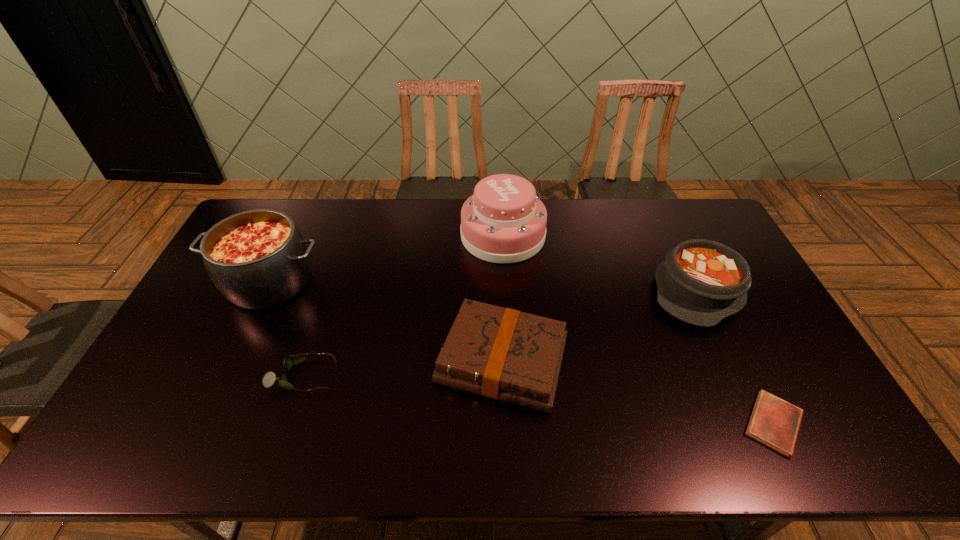
Locate an element on the screen. cake is located at coordinates (504, 221).

Identify the location of the taller casserole. (257, 259).

You are a GUI agent. You are given a task and a screenshot of the screen. Output one action in this format:
    pyautogui.click(x=<x>, y=<y>)
    Task: Click on the right casserole
    The image size is (960, 540).
    Given the screenshot: What is the action you would take?
    pyautogui.click(x=701, y=282)

Where is `the fourth shortest object`? the fourth shortest object is located at coordinates (701, 282).

In order to click on hardback book in this screenshot , I will do `click(500, 353)`.

Find the location of a particular element. This screenshot has height=540, width=960. the fifth tallest object is located at coordinates (269, 378).

You are a GUI agent. You are given a task and a screenshot of the screen. Output one action in this format:
    pyautogui.click(x=<x>, y=<y>)
    Task: Click on the shortest object
    The width and height of the screenshot is (960, 540).
    Given the screenshot: What is the action you would take?
    pyautogui.click(x=774, y=422)

Image resolution: width=960 pixels, height=540 pixels. I want to click on vacant space located on the left of the cake, so click(392, 235).

At what (x,y) coordinates should I click in order to perform the action: click on blank space located 0.130m on the back of the taller casserole. Please return your answer as a coordinate pair (x, y). Looking at the image, I should click on [295, 228].

Where is `vacant space located on the left of the third tallest object`? The image size is (960, 540). vacant space located on the left of the third tallest object is located at coordinates pos(540,290).